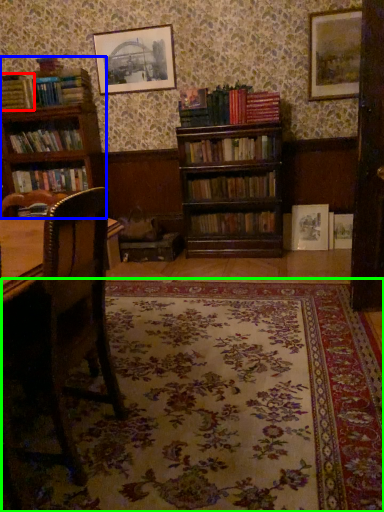
Question: Estimate the real-world distances between objects in this image. Which object is farther from book (highlighted by a red box), bookcase (highlighted by a blue box) or pattern (highlighted by a green box)?

Choices:
 (A) bookcase
 (B) pattern

Answer: (B)